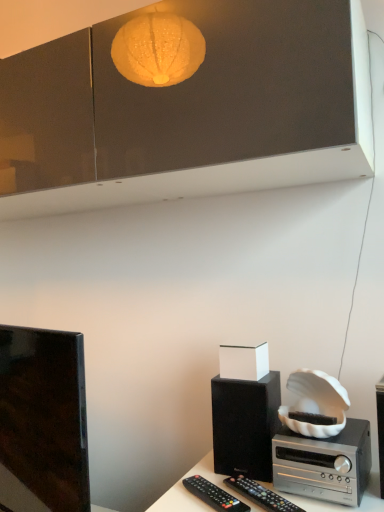
Measure the distance between point (x=242, y=476) and camera.

A distance of 38.90 inches exists between point (x=242, y=476) and camera.

Measure the distance between point (226, 454) and camera.

Point (226, 454) and camera are 3.34 feet apart.

Describe the element at coordinates (380, 430) in the screenshot. The width and height of the screenshot is (384, 512). I see `black matte speaker at right` at that location.

Measure the distance between point (194, 483) and camera.

The distance of point (194, 483) from camera is 37.60 inches.

I want to click on black plastic remote control at lower center, the 1th remote control in the left-to-right sequence, so click(213, 495).

At what (x,y) coordinates should I click in order to perform the action: click on black plastic remote at lower right, the first remote control in the right-to-left sequence. Please return your answer as a coordinate pair (x, y). Looking at the image, I should click on (261, 495).

Between point (14, 435) and point (283, 502), which one is positioned in front?

The point (283, 502) is closer.

Is black plastic remote at lower right, the first remote control in the right-to-left sequence, at the back of shiny black tv at left?

No.

Can you confirm if shiny black tv at left is positioned to the left of black plastic remote at lower right, the first remote control in the right-to-left sequence?

Yes.

Does silver metallic stereo at lower right appear on the left side of black matte speaker at right?

Yes.

You are a GUI agent. You are given a task and a screenshot of the screen. Output one action in this format:
    pyautogui.click(x=<x>, y=<y>)
    Task: Click on the stereo that is under the black matte speaker at right (from a real-world perspective)
    The image size is (384, 512).
    Given the screenshot: What is the action you would take?
    pyautogui.click(x=324, y=463)

Is silver metallic stereo at lower right further to the viewer compared to black matte speaker at right?

Yes, silver metallic stereo at lower right is behind black matte speaker at right.

Based on the photo, is there a large distance between silver metallic stereo at lower right and black matte speaker at right?

silver metallic stereo at lower right is actually quite close to black matte speaker at right.

From a real-world perspective, which object rests below the other?

black plastic remote at lower right, the 2th remote control in the left-to-right sequence.

Is shiny black tv at left at the back of black plastic remote at lower right, the first remote control in the right-to-left sequence?

black plastic remote at lower right, the first remote control in the right-to-left sequence, is not turned away from shiny black tv at left.

Looking at this image, between black plastic remote at lower right, the 2th remote control in the left-to-right sequence, and shiny black tv at left, which one has smaller width?

Thinner between the two is black plastic remote at lower right, the 2th remote control in the left-to-right sequence.

How different are the orientations of black plastic remote at lower right, the first remote control in the right-to-left sequence, and shiny black tv at left in degrees?

The facing directions of black plastic remote at lower right, the first remote control in the right-to-left sequence, and shiny black tv at left are 21.5 degrees apart.

Can you confirm if black matte speaker at right is shorter than shiny black tv at left?

Correct, black matte speaker at right is not as tall as shiny black tv at left.

Is black matte speaker at right wider than shiny black tv at left?

Correct, the width of black matte speaker at right exceeds that of shiny black tv at left.

Is black matte speaker at right oriented away from shiny black tv at left?

No, black matte speaker at right is not facing away from shiny black tv at left.

Is shiny black tv at left spatially inside black matte speaker at right, or outside of it?

shiny black tv at left is spatially situated outside black matte speaker at right.

Is shiny black tv at left in front of or behind black matte speaker at right in the image?

shiny black tv at left is behind black matte speaker at right.

Is point (76, 368) closer to viewer compared to point (376, 384)?

Yes, it is.

Does shiny black tv at left appear on the right side of black matte speaker at right?

In fact, shiny black tv at left is to the left of black matte speaker at right.

Locate an element on the screen. The width and height of the screenshot is (384, 512). television that appears below the silver metallic stereo at lower right (from a real-world perspective) is located at coordinates (43, 421).

From a real-world perspective, is shiny black tv at left under silver metallic stereo at lower right?

Correct, in the physical world, shiny black tv at left is lower than silver metallic stereo at lower right.

In the scene shown: From the image's perspective, is shiny black tv at left over silver metallic stereo at lower right?

Actually, shiny black tv at left appears below silver metallic stereo at lower right in the image.

Between black plastic remote control at lower center, positioned as the 2th remote control in right-to-left order, and black matte speaker at lower right, which one has larger size?

Bigger between the two is black matte speaker at lower right.

Which point is more forward, (205, 490) or (218, 453)?

The point (205, 490) is closer to the camera.

Choose the correct answer: Is black plastic remote control at lower center, positioned as the 2th remote control in right-to-left order, inside black matte speaker at lower right or outside it?

black plastic remote control at lower center, positioned as the 2th remote control in right-to-left order, exists outside the volume of black matte speaker at lower right.

Can you see black plastic remote control at lower center, positioned as the 2th remote control in right-to-left order, touching black matte speaker at lower right?

No, black plastic remote control at lower center, positioned as the 2th remote control in right-to-left order, is not beside black matte speaker at lower right.

Find the location of `television behind the black plastic remote at lower right, the first remote control in the right-to-left sequence`. television behind the black plastic remote at lower right, the first remote control in the right-to-left sequence is located at coordinates (43, 421).

Image resolution: width=384 pixels, height=512 pixels. I want to click on speaker above the silver metallic stereo at lower right (from a real-world perspective), so click(380, 430).

When comparing their distances from black matte speaker at right, does black plastic remote at lower right, the 2th remote control in the left-to-right sequence, or shiny black tv at left seem closer?

black plastic remote at lower right, the 2th remote control in the left-to-right sequence, lies closer to black matte speaker at right than the other object.

Based on their spatial positions, is black plastic remote control at lower center, positioned as the 2th remote control in right-to-left order, or shiny black tv at left further from black matte speaker at right?

shiny black tv at left is further to black matte speaker at right.

Which object lies further to the anchor point black matte speaker at lower right, black plastic remote control at lower center, the 1th remote control in the left-to-right sequence, or shiny black tv at left?

Among the two, shiny black tv at left is located further to black matte speaker at lower right.

Looking at the image, which one is located further to black matte speaker at lower right, black matte speaker at right or silver metallic stereo at lower right?

black matte speaker at right lies further to black matte speaker at lower right than the other object.

Estimate the real-world distances between objects in this image. Which object is closer to black matte speaker at right, silver metallic stereo at lower right or black matte speaker at lower right?

silver metallic stereo at lower right lies closer to black matte speaker at right than the other object.

Looking at the image, which one is located closer to black matte speaker at right, silver metallic stereo at lower right or black plastic remote control at lower center, the 1th remote control in the left-to-right sequence?

Among the two, silver metallic stereo at lower right is located nearer to black matte speaker at right.

When comparing their distances from shiny black tv at left, does black plastic remote control at lower center, positioned as the 2th remote control in right-to-left order, or black matte speaker at right seem further?

The object further to shiny black tv at left is black matte speaker at right.

From the image, which object appears to be nearer to shiny black tv at left, black matte speaker at lower right or black matte speaker at right?

Based on the image, black matte speaker at lower right appears to be nearer to shiny black tv at left.

This screenshot has height=512, width=384. In order to click on remote control positioned between black plastic remote at lower right, the first remote control in the right-to-left sequence, and black matte speaker at lower right from near to far in this screenshot , I will do `click(213, 495)`.

Find the location of a particular element. The image size is (384, 512). remote control situated between black matte speaker at lower right and black matte speaker at right from left to right is located at coordinates point(261,495).

You are a GUI agent. You are given a task and a screenshot of the screen. Output one action in this format:
    pyautogui.click(x=<x>, y=<y>)
    Task: Click on the stereo between black plastic remote control at lower center, positioned as the 2th remote control in right-to-left order, and black matte speaker at right
    The height and width of the screenshot is (512, 384).
    Given the screenshot: What is the action you would take?
    pyautogui.click(x=324, y=463)

Locate an element on the screen. The height and width of the screenshot is (512, 384). stereo between black plastic remote at lower right, the 2th remote control in the left-to-right sequence, and black matte speaker at right is located at coordinates (324, 463).